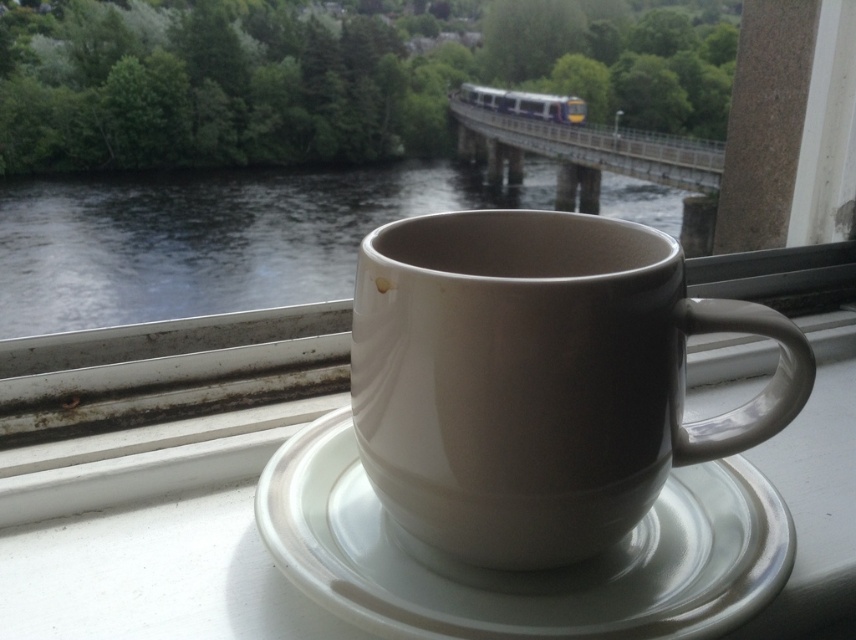
Find the location of `white glossy saucer at center`. white glossy saucer at center is located at coordinates [527, 572].

Is point (599, 608) more distant than point (52, 257)?

That is False.

The height and width of the screenshot is (640, 856). Find the location of `white glossy saucer at center`. white glossy saucer at center is located at coordinates (527, 572).

Is white glossy saucer at center shorter than metallic silver train at center?

No.

Who is more forward, (574, 598) or (509, 93)?

Point (574, 598) is more forward.

Who is more distant from viewer, (756, 595) or (492, 93)?

Positioned behind is point (492, 93).

I want to click on white glossy saucer at center, so click(527, 572).

Is matte ceramic mug at center positioned in front of metallic silver train at center?

That is True.

Identify the location of matte ceramic mug at center. (538, 380).

Where is `matte ceramic mug at center`? This screenshot has height=640, width=856. matte ceramic mug at center is located at coordinates click(x=538, y=380).